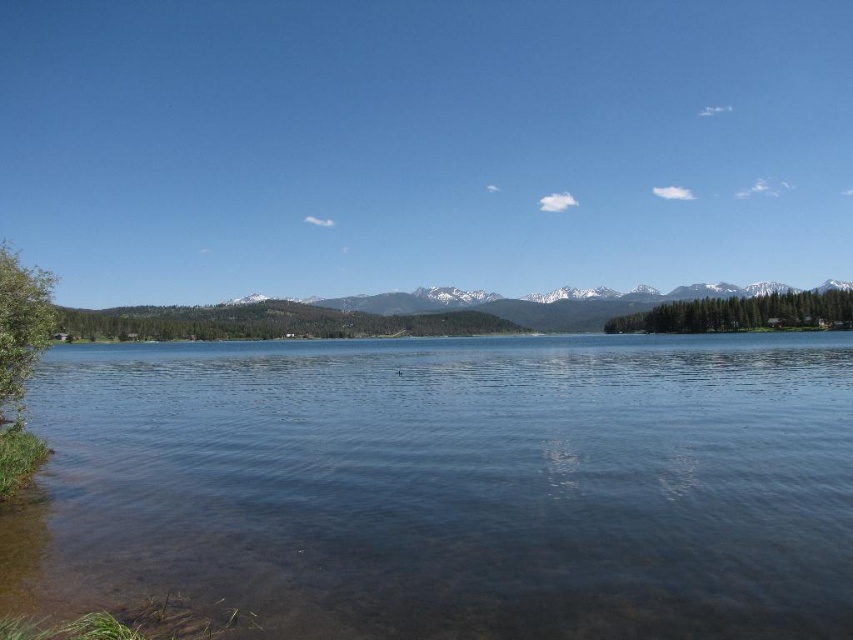
You are standing at the point marked as point (462, 483) in the image. What do you see immediately in front of you?

You see clear water at lower left immediately in front of you at point (462, 483).

You are an observer standing at the lakeside. You notice the clear water at lower left and the snowy white mountain at center. Which object appears narrower in the scene?

The clear water at lower left appears narrower than the snowy white mountain at center.